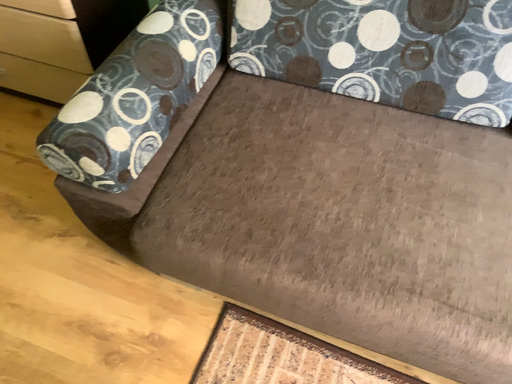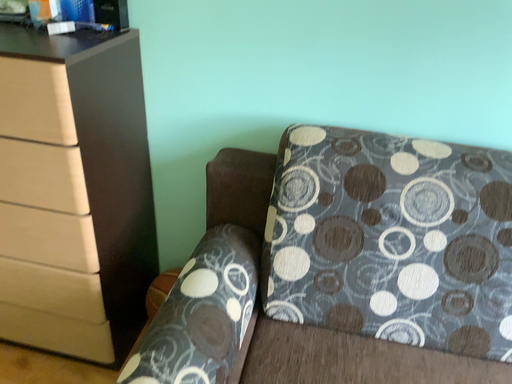
Question: How did the camera likely rotate when shooting the video?

Choices:
 (A) rotated right
 (B) rotated left

Answer: (A)